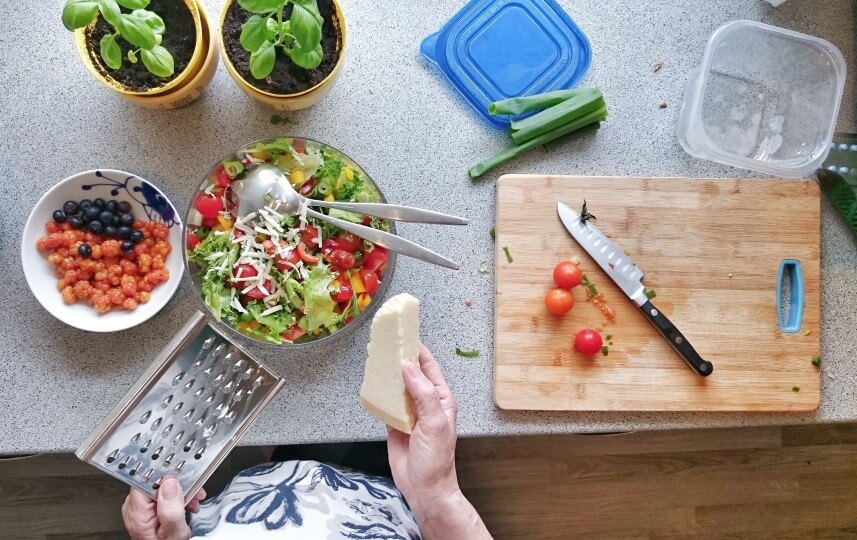
Image resolution: width=857 pixels, height=540 pixels. Identify the location of cutting board. (650, 382).